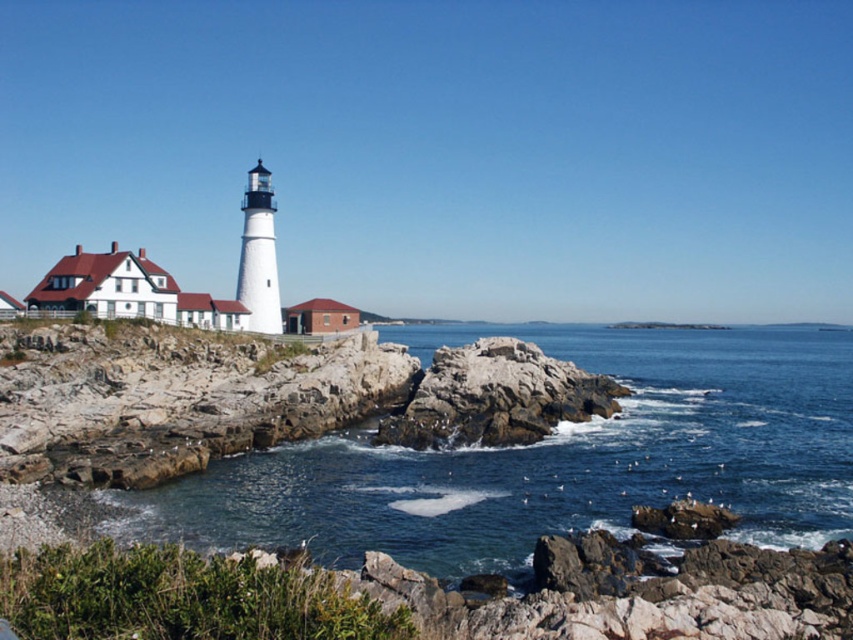
Question: Does clear blue water at center have a greater width compared to rocky outcrop at center?

Choices:
 (A) yes
 (B) no

Answer: (A)

Question: Which point is closer to the camera?

Choices:
 (A) (413, 483)
 (B) (590, 406)

Answer: (A)

Question: Can you confirm if clear blue water at center is positioned to the right of rocky outcrop at center?

Choices:
 (A) yes
 (B) no

Answer: (A)

Question: Observing the image, what is the correct spatial positioning of clear blue water at center in reference to rocky outcrop at center?

Choices:
 (A) above
 (B) below

Answer: (A)

Question: Which object appears closest to the camera in this image?

Choices:
 (A) clear blue water at center
 (B) rocky outcrop at center

Answer: (A)

Question: Among these points, which one is nearest to the camera?

Choices:
 (A) coord(463,477)
 (B) coord(543,392)

Answer: (A)